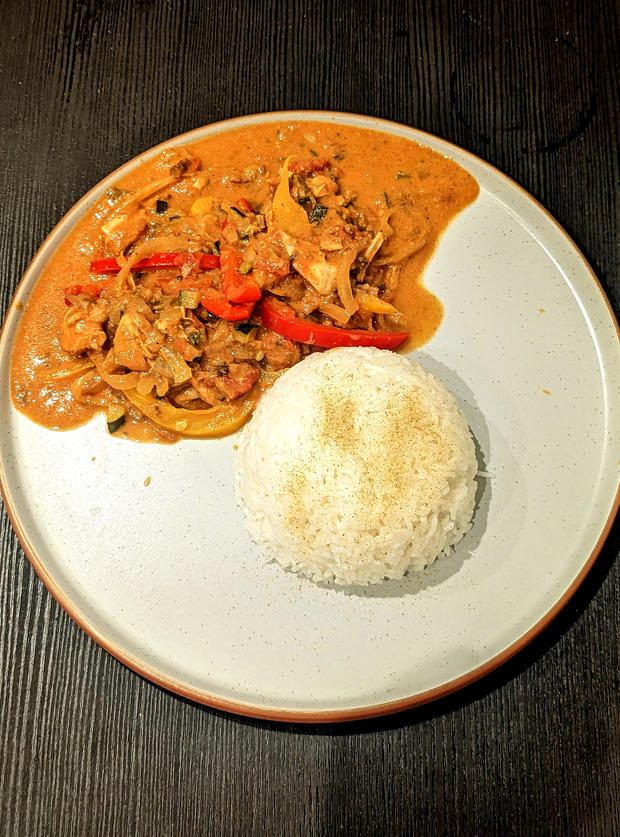
Where is `white plate`? white plate is located at coordinates (479, 639).